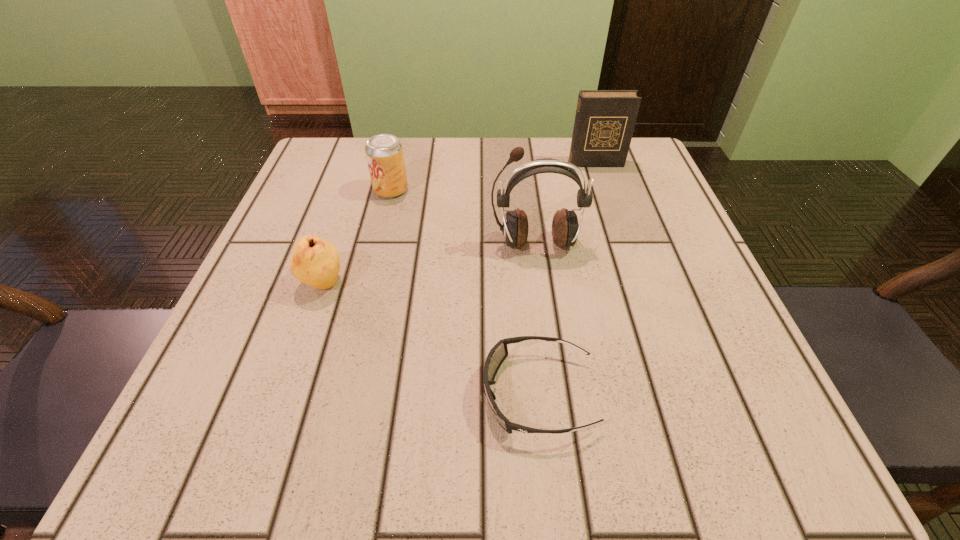
Identify the location of earphone. (565, 228).

The height and width of the screenshot is (540, 960). I want to click on the third nearest object, so click(565, 228).

This screenshot has height=540, width=960. I want to click on the rightmost object, so click(604, 124).

You are a GUI agent. You are given a task and a screenshot of the screen. Output one action in this format:
    pyautogui.click(x=<x>, y=<y>)
    Task: Click on the second tallest object
    This screenshot has height=540, width=960.
    Given the screenshot: What is the action you would take?
    pyautogui.click(x=604, y=124)

Locate an element on the screen. The width and height of the screenshot is (960, 540). the second farthest object is located at coordinates (384, 152).

Where is `pop (soda)`? Image resolution: width=960 pixels, height=540 pixels. pop (soda) is located at coordinates (384, 152).

The height and width of the screenshot is (540, 960). I want to click on the leftmost object, so click(x=314, y=261).

This screenshot has height=540, width=960. Identify the location of the fourth farthest object. (314, 261).

At what (x,y) coordinates should I click in order to perform the action: click on the nearest object. Please return your answer as a coordinate pair (x, y). Image resolution: width=960 pixels, height=540 pixels. Looking at the image, I should click on tap(497, 355).

Locate an element on the screen. The image size is (960, 540). goggles is located at coordinates (497, 355).